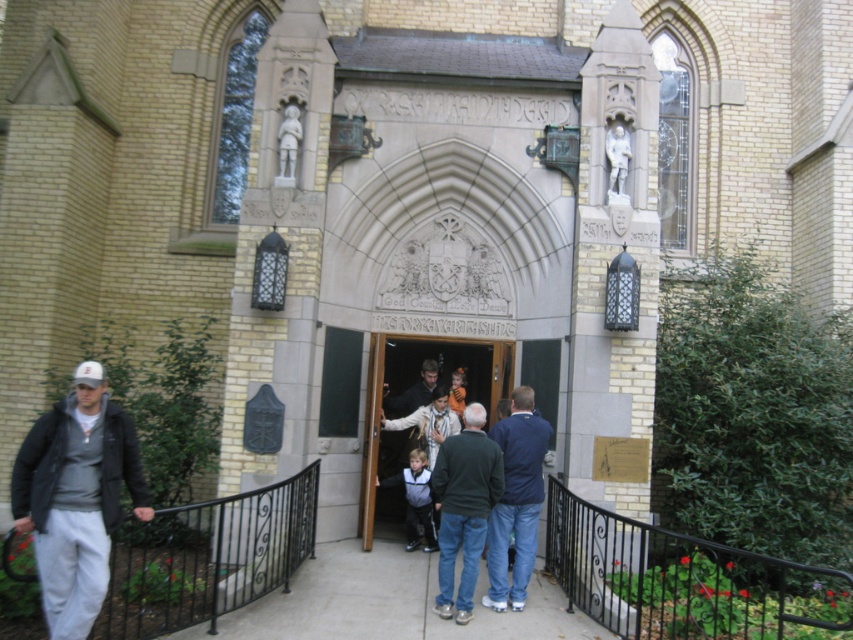
Who is lower down, matte stone door at center or dark blue jacket at center?

Positioned lower is dark blue jacket at center.

Does matte stone door at center have a lesser height compared to dark blue jacket at center?

Indeed, matte stone door at center has a lesser height compared to dark blue jacket at center.

Does point (490, 378) lie behind point (412, 508)?

Yes, point (490, 378) is farther from viewer.

Find the location of a particular element. The width and height of the screenshot is (853, 640). matte stone door at center is located at coordinates (408, 422).

Can you confirm if dark green sweater at center is positioned to the right of dark blue jacket at center?

Correct, you'll find dark green sweater at center to the right of dark blue jacket at center.

Which is below, dark green sweater at center or dark blue jacket at center?

Positioned lower is dark blue jacket at center.

This screenshot has width=853, height=640. What are the coordinates of `dark green sweater at center` in the screenshot? It's located at (463, 508).

Can you confirm if matte black jacket at left is positioned above dark blue jacket at center?

Correct, matte black jacket at left is located above dark blue jacket at center.

Measure the distance between point (109, 499) and camera.

They are 13.37 meters apart.

At what (x,y) coordinates should I click in order to perform the action: click on matte black jacket at left. Please return your answer as a coordinate pair (x, y). Image resolution: width=853 pixels, height=640 pixels. Looking at the image, I should click on (76, 497).